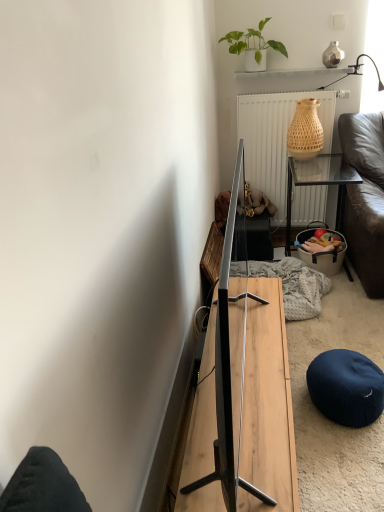
Find the location of a particular element. This screenshot has height=512, width=384. unoccupied area behind dark blue fabric stool at lower right is located at coordinates (335, 342).